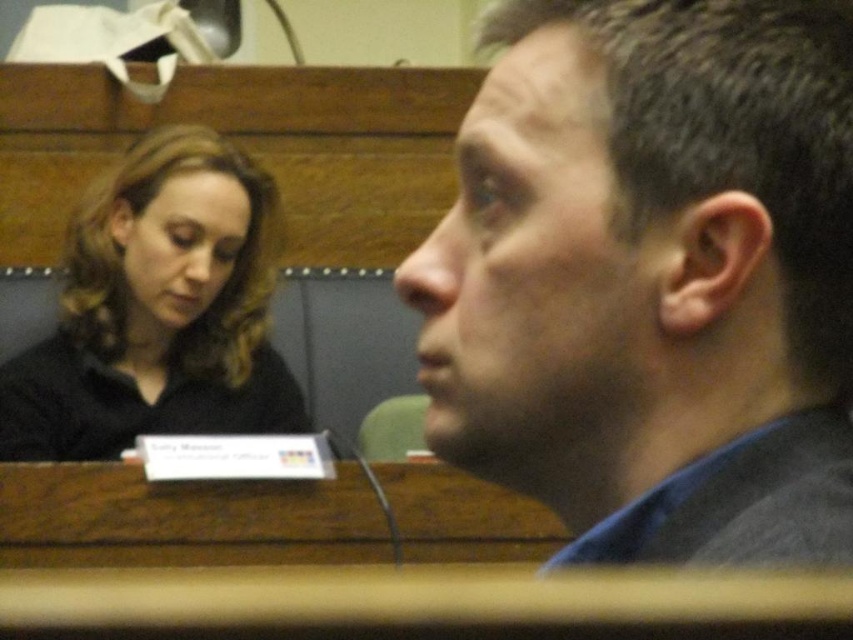
Question: Can you confirm if dark gray hair at upper right is wider than black matte hair at upper left?

Choices:
 (A) yes
 (B) no

Answer: (B)

Question: Can you confirm if dark gray hair at upper right is smaller than black matte hair at upper left?

Choices:
 (A) yes
 (B) no

Answer: (A)

Question: Considering the relative positions of dark gray hair at upper right and black matte hair at upper left in the image provided, where is dark gray hair at upper right located with respect to black matte hair at upper left?

Choices:
 (A) right
 (B) left

Answer: (A)

Question: Among these points, which one is farthest from the camera?

Choices:
 (A) (186, 140)
 (B) (711, 141)

Answer: (A)